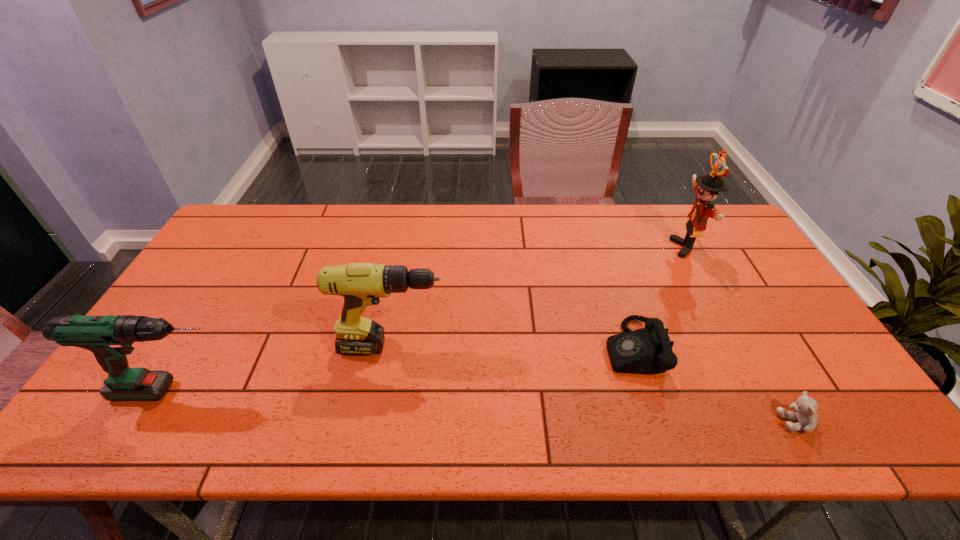
Identify the location of vacant space in between the fourth object from right to left and the nutcracker. (540, 297).

You are a GUI agent. You are given a task and a screenshot of the screen. Output one action in this format:
    pyautogui.click(x=<x>, y=<y>)
    Task: Click on the third closest object to the fourth object from right to left
    
    Given the screenshot: What is the action you would take?
    pyautogui.click(x=706, y=187)

Choose which object is the nearest neighbor to the third object from left to right. Please provide its 2D coordinates. Your answer should be formatted as a tuple, i.e. [(x, y)], where the tuple contains the x and y coordinates of a point satisfying the conditions above.

[(805, 407)]